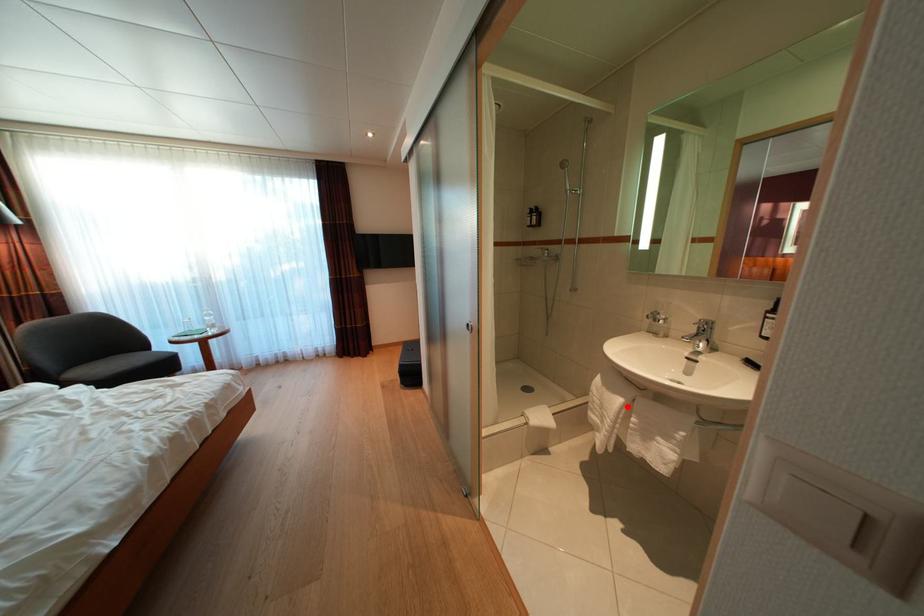
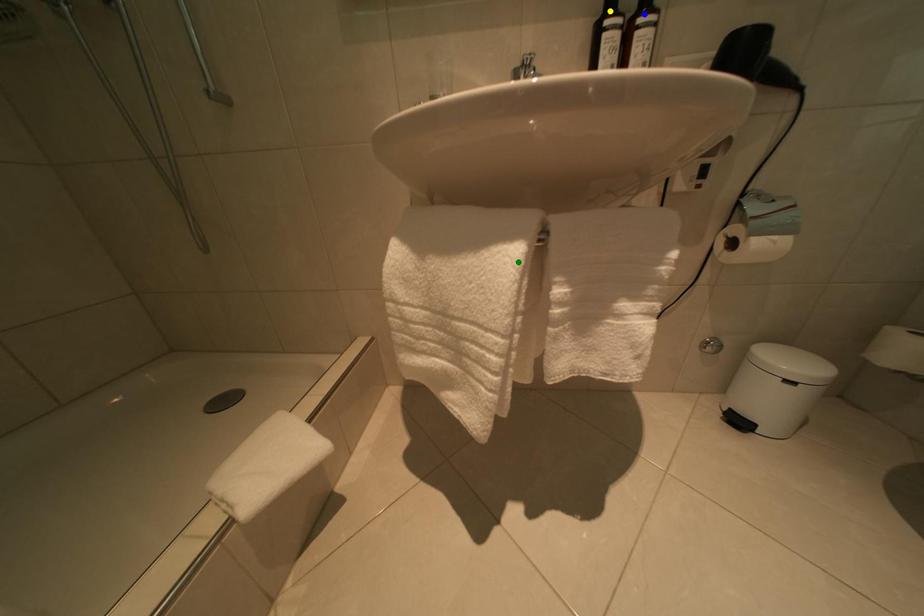
Question: I am providing you with two images of the same scene from different viewpoints. A red point is marked on the first image. You are given multiple points on the second image. Can you choose the point in image 2 that corresponds to the point in image 1?

Choices:
 (A) green point
 (B) blue point
 (C) yellow point

Answer: (A)